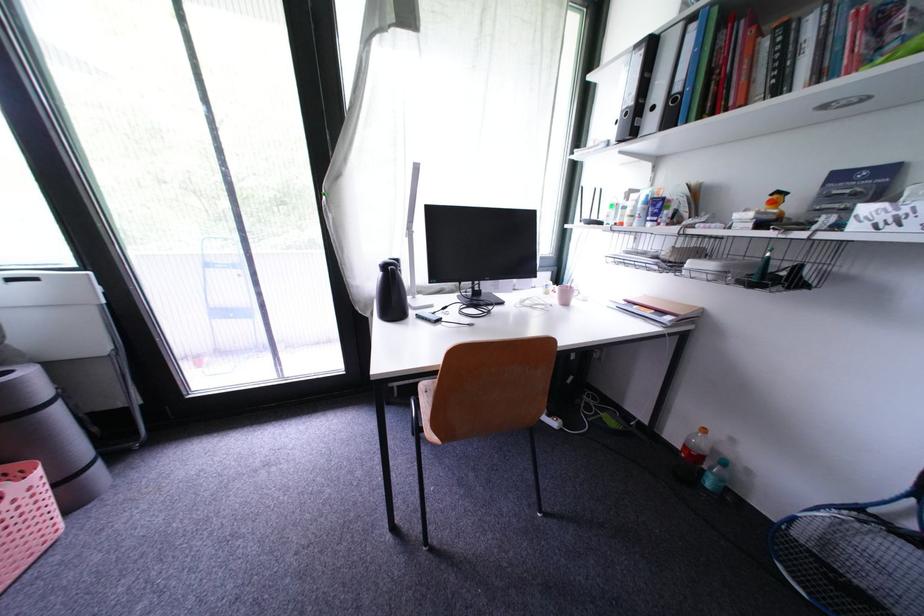
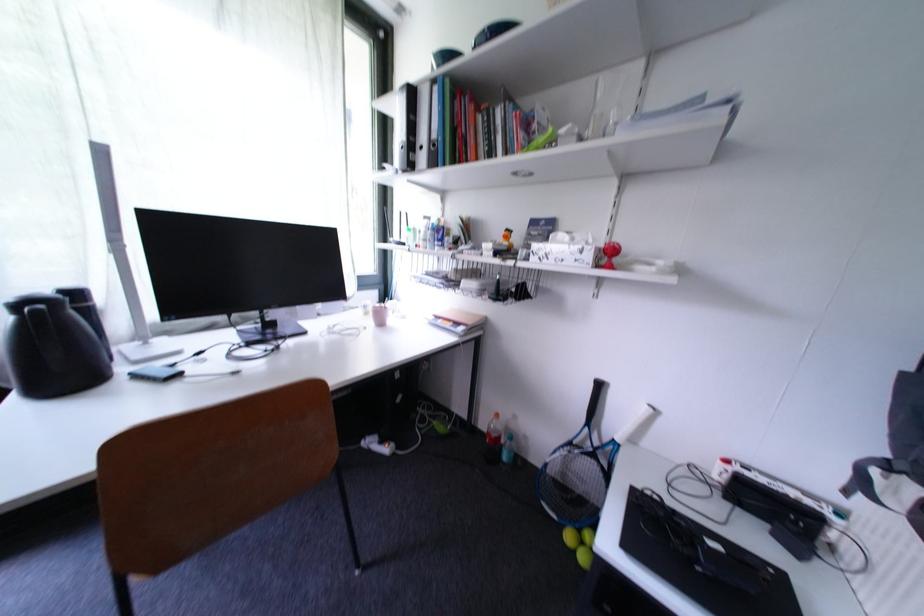
The point at [700,30] is marked in the first image. Where is the corresponding point in the second image?

(444, 91)